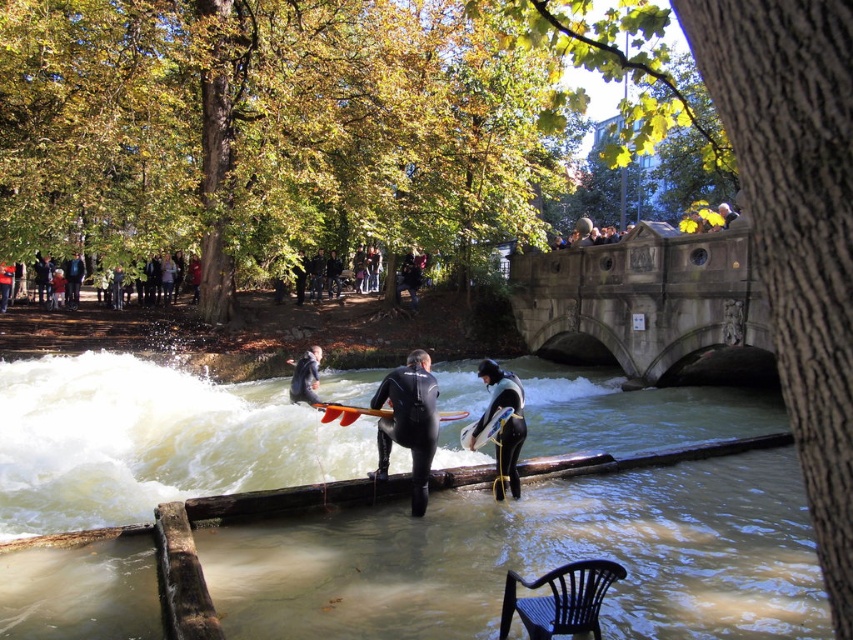
Question: Which point appears closest to the camera in this image?

Choices:
 (A) (289, 394)
 (B) (335, 404)
 (C) (396, 394)

Answer: (C)

Question: Observing the image, what is the correct spatial positioning of orange plastic paddle at center in reference to white foam surfboard at center?

Choices:
 (A) left
 (B) right

Answer: (A)

Question: Is stone bridge at center thinner than black wetsuit surfer at center?

Choices:
 (A) yes
 (B) no

Answer: (B)

Question: Which object is farther from the camera taking this photo?

Choices:
 (A) black wetsuit surfer at center
 (B) brown rubber boat at center

Answer: (A)

Question: Which of the following is the farthest from the observer?

Choices:
 (A) orange plastic paddle at center
 (B) black wetsuit surfer at center

Answer: (B)

Question: Can you confirm if brown rubber boat at center is bigger than black matte wetsuit at center?

Choices:
 (A) yes
 (B) no

Answer: (A)